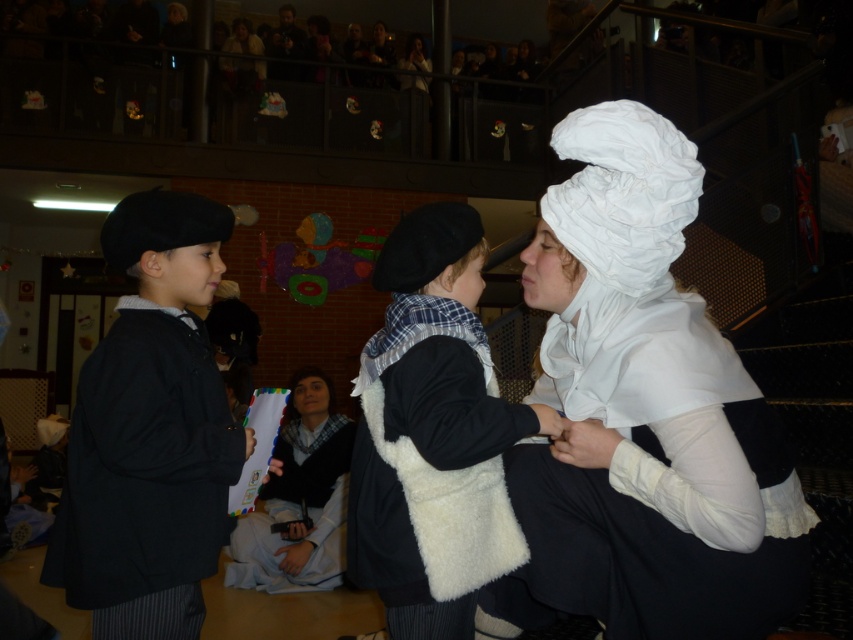
Between white satin bonnet at center and matte black coat at left, which one has less height?

Standing shorter between the two is matte black coat at left.

Does white satin bonnet at center appear on the left side of matte black coat at left?

In fact, white satin bonnet at center is to the right of matte black coat at left.

Identify the location of white satin bonnet at center. Image resolution: width=853 pixels, height=640 pixels. (643, 417).

Is matte black coat at left above white fluffy vest at center?

Indeed, matte black coat at left is positioned over white fluffy vest at center.

Between point (155, 349) and point (418, 516), which one is positioned in front?

Point (418, 516) is more forward.

Describe the element at coordinates (149, 433) in the screenshot. I see `matte black coat at left` at that location.

I want to click on matte black coat at left, so click(x=149, y=433).

Does white satin bonnet at center appear over white fluffy vest at center?

Correct, white satin bonnet at center is located above white fluffy vest at center.

Is white satin bonnet at center smaller than white fluffy vest at center?

Actually, white satin bonnet at center might be larger than white fluffy vest at center.

Describe the element at coordinates (643, 417) in the screenshot. The width and height of the screenshot is (853, 640). I see `white satin bonnet at center` at that location.

This screenshot has width=853, height=640. I want to click on white satin bonnet at center, so click(643, 417).